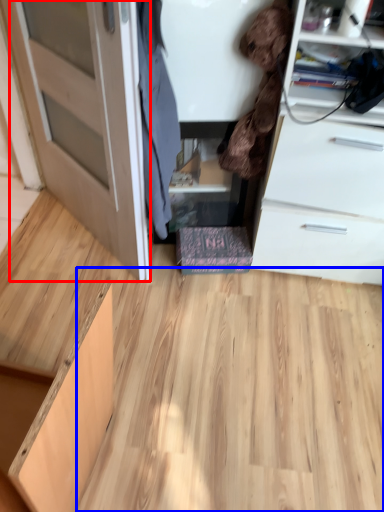
Question: Which point is closer to the camera, door (highlighted by a red box) or plywood (highlighted by a blue box)?

Choices:
 (A) door
 (B) plywood

Answer: (A)